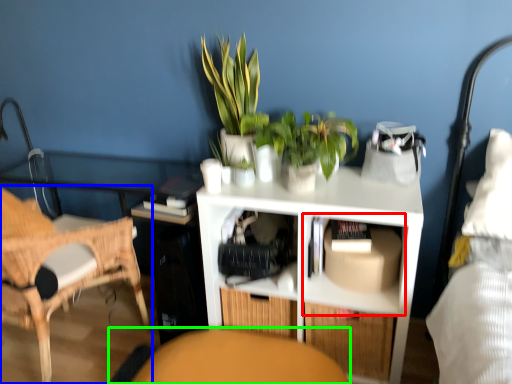
Question: Based on their relative distances, which object is farther from cabinet (highlighted by a red box)? Choose from chair (highlighted by a blue box) and swivel chair (highlighted by a green box).

Choices:
 (A) chair
 (B) swivel chair

Answer: (A)